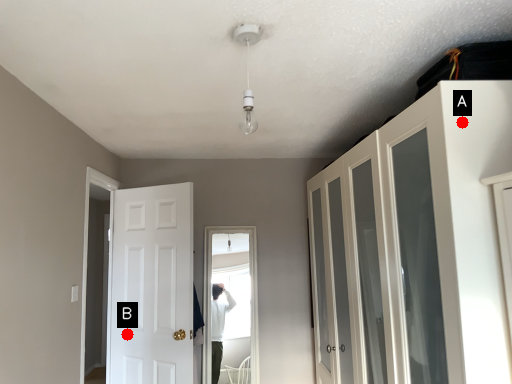
Question: Two points are circled on the image, labeled by A and B beside each circle. Which point is further to the camera?

Choices:
 (A) A is further
 (B) B is further

Answer: (B)